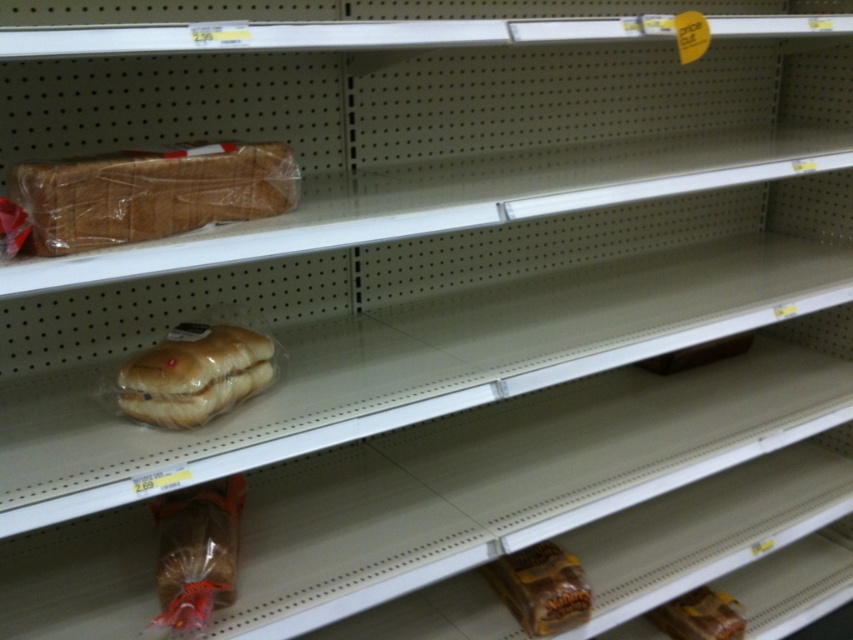
Question: Where is translucent plastic loaf of bread at upper left located in relation to brown matte bread at lower right in the image?

Choices:
 (A) above
 (B) below

Answer: (A)

Question: Which point appears closest to the camera in this image?

Choices:
 (A) (555, 573)
 (B) (70, 195)
 (C) (154, 426)

Answer: (B)

Question: Estimate the real-world distances between objects in this image. Which object is closer to the golden matte bread at center?

Choices:
 (A) translucent plastic loaf of bread at upper left
 (B) brown matte bread at lower right

Answer: (A)

Question: From the image, what is the correct spatial relationship of translucent plastic loaf of bread at upper left in relation to brown matte bread at lower right?

Choices:
 (A) below
 (B) above

Answer: (B)

Question: Can you confirm if translucent plastic loaf of bread at upper left is wider than golden matte bread at center?

Choices:
 (A) yes
 (B) no

Answer: (A)

Question: Which of the following is the closest to the observer?

Choices:
 (A) (221, 195)
 (B) (204, 406)

Answer: (A)